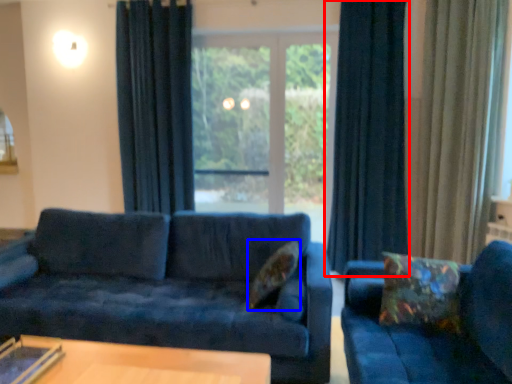
Question: Which point is further to the camera, curtain (highlighted by a red box) or pillow (highlighted by a blue box)?

Choices:
 (A) curtain
 (B) pillow

Answer: (A)